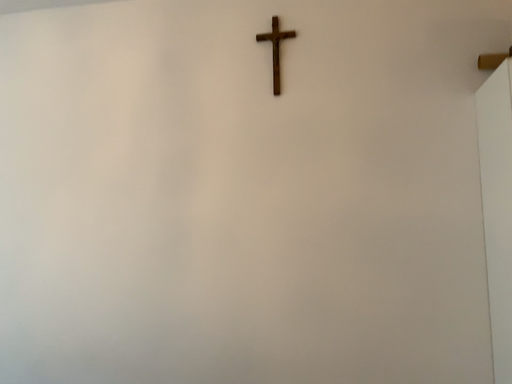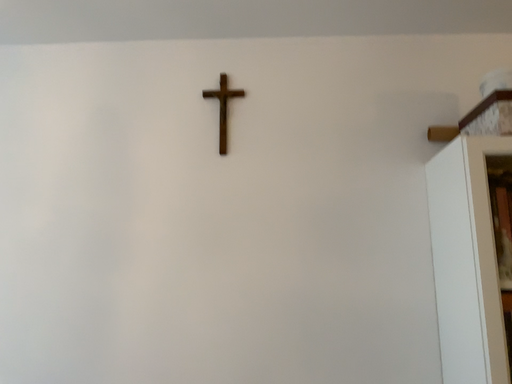
Question: How did the camera likely rotate when shooting the video?

Choices:
 (A) rotated left
 (B) rotated right

Answer: (B)